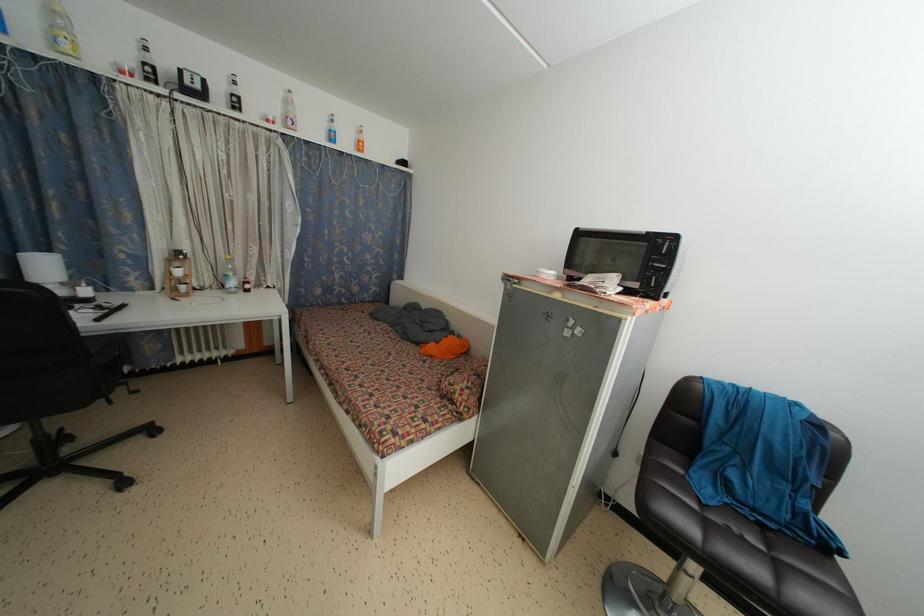
Image resolution: width=924 pixels, height=616 pixels. Identify the location of clear plastic bottle. (228, 275).